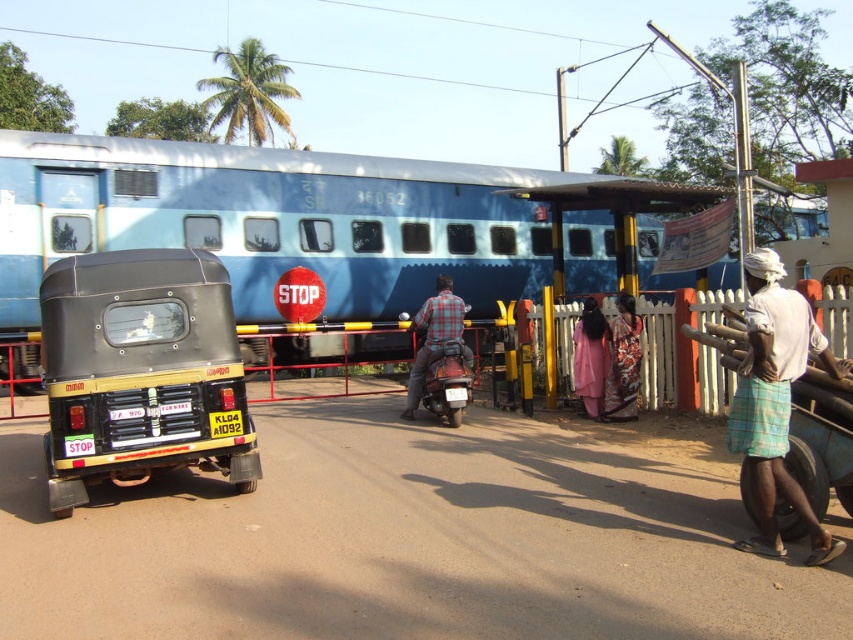
Does floral fabric dress at center have a lesser width compared to pink fabric dress at center?

In fact, floral fabric dress at center might be wider than pink fabric dress at center.

Who is higher up, floral fabric dress at center or pink fabric dress at center?

pink fabric dress at center is higher up.

Describe the element at coordinates (624, 360) in the screenshot. Image resolution: width=853 pixels, height=640 pixels. I see `floral fabric dress at center` at that location.

Find the location of a particular element. floral fabric dress at center is located at coordinates (624, 360).

How distant is matte black auto-rickshaw at lower left from checkered fabric shirt at center?

A distance of 3.92 meters exists between matte black auto-rickshaw at lower left and checkered fabric shirt at center.

Can you confirm if matte black auto-rickshaw at lower left is wider than checkered fabric shirt at center?

Yes, matte black auto-rickshaw at lower left is wider than checkered fabric shirt at center.

Is point (187, 257) in front of point (418, 320)?

Yes, point (187, 257) is in front of point (418, 320).

Find the location of a particular element. matte black auto-rickshaw at lower left is located at coordinates (141, 371).

Is point (459, 330) positioned behind point (618, 406)?

No.

Which is more to the right, checkered fabric shirt at center or floral fabric dress at center?

From the viewer's perspective, floral fabric dress at center appears more on the right side.

Who is more forward, (x=445, y=321) or (x=619, y=316)?

Positioned in front is point (x=445, y=321).

The image size is (853, 640). Find the location of `checkered fabric shirt at center`. checkered fabric shirt at center is located at coordinates (434, 337).